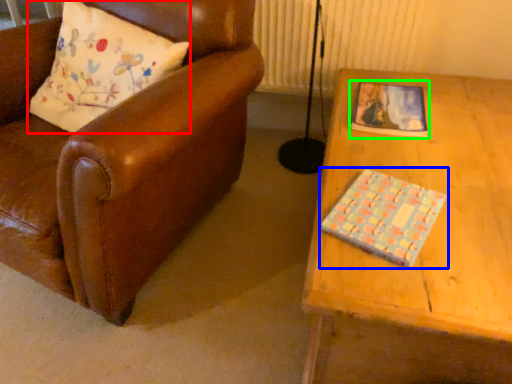
Question: Which object is the farthest from pillow (highlighted by a red box)? Choose among these: book (highlighted by a blue box) or book (highlighted by a green box).

Choices:
 (A) book
 (B) book

Answer: (A)